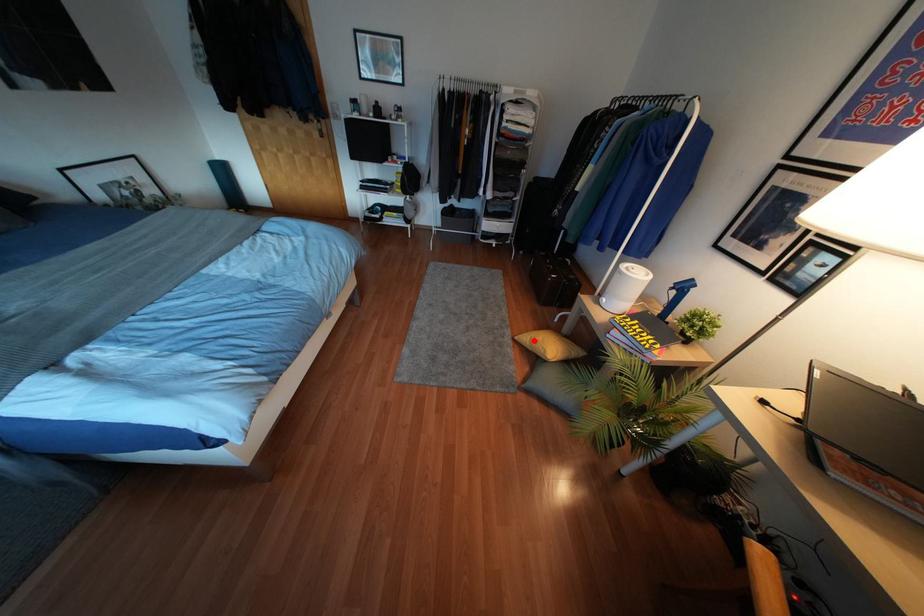
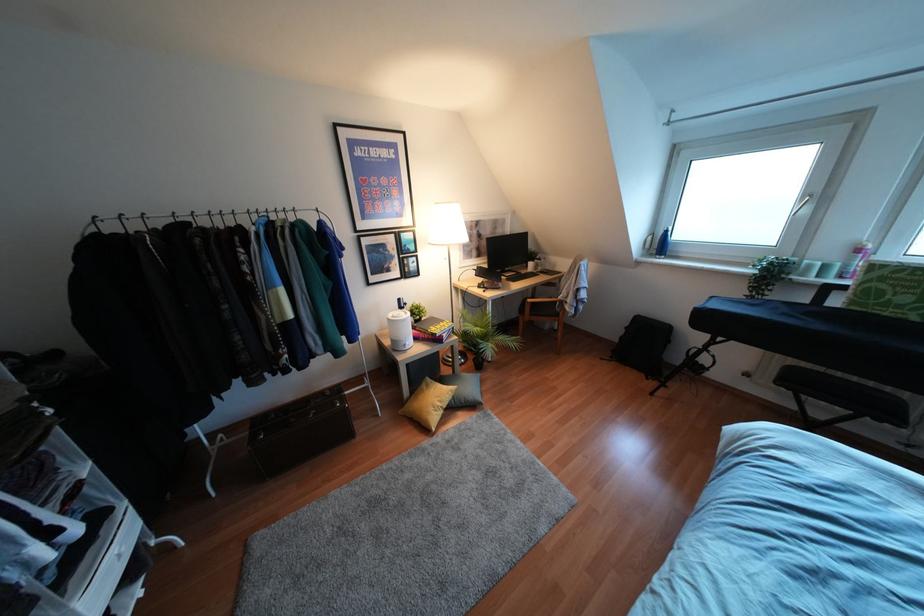
Question: I am providing you with two images of the same scene from different viewpoints. In image1, a red point is highlighted. Considering the same 3D point in image2, which of the following is correct?

Choices:
 (A) It is closer
 (B) It is farther

Answer: (B)